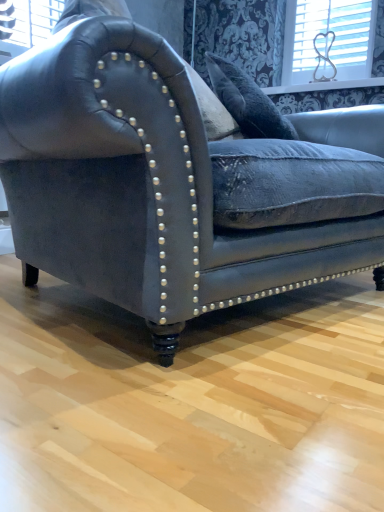
Question: Is white plastic heart at upper right facing towards matte black leather couch at center?

Choices:
 (A) no
 (B) yes

Answer: (A)

Question: Considering the relative positions of white plastic heart at upper right and matte black leather couch at center in the image provided, is white plastic heart at upper right to the right of matte black leather couch at center from the viewer's perspective?

Choices:
 (A) yes
 (B) no

Answer: (A)

Question: Considering the relative sizes of white plastic heart at upper right and matte black leather couch at center in the image provided, is white plastic heart at upper right wider than matte black leather couch at center?

Choices:
 (A) yes
 (B) no

Answer: (B)

Question: Are white plastic heart at upper right and matte black leather couch at center beside each other?

Choices:
 (A) no
 (B) yes

Answer: (A)

Question: Does white plastic heart at upper right have a smaller size compared to matte black leather couch at center?

Choices:
 (A) yes
 (B) no

Answer: (A)

Question: Is white plastic heart at upper right shorter than matte black leather couch at center?

Choices:
 (A) yes
 (B) no

Answer: (A)

Question: Is matte black leather couch at center shorter than white plastic heart at upper right?

Choices:
 (A) no
 (B) yes

Answer: (A)

Question: From a real-world perspective, is matte black leather couch at center located higher than white plastic heart at upper right?

Choices:
 (A) yes
 (B) no

Answer: (B)

Question: Is matte black leather couch at center not inside white plastic heart at upper right?

Choices:
 (A) no
 (B) yes

Answer: (B)

Question: Is matte black leather couch at center looking in the opposite direction of white plastic heart at upper right?

Choices:
 (A) yes
 (B) no

Answer: (B)

Question: Can you confirm if matte black leather couch at center is bigger than white plastic heart at upper right?

Choices:
 (A) no
 (B) yes

Answer: (B)

Question: Could you tell me if matte black leather couch at center is turned towards white plastic heart at upper right?

Choices:
 (A) no
 (B) yes

Answer: (A)

Question: Is white plastic heart at upper right taller or shorter than matte black leather couch at center?

Choices:
 (A) short
 (B) tall

Answer: (A)